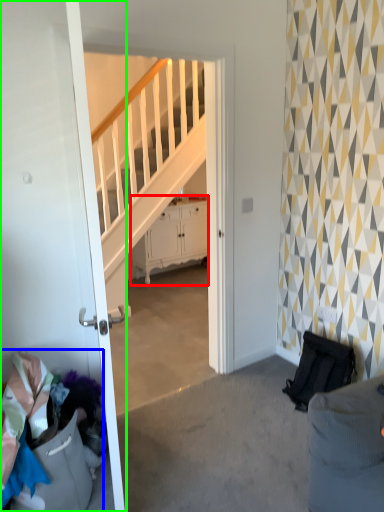
Question: Which object is positioned farthest from cabinetry (highlighted by a red box)? Select from laundry (highlighted by a blue box) and door (highlighted by a green box).

Choices:
 (A) laundry
 (B) door

Answer: (A)